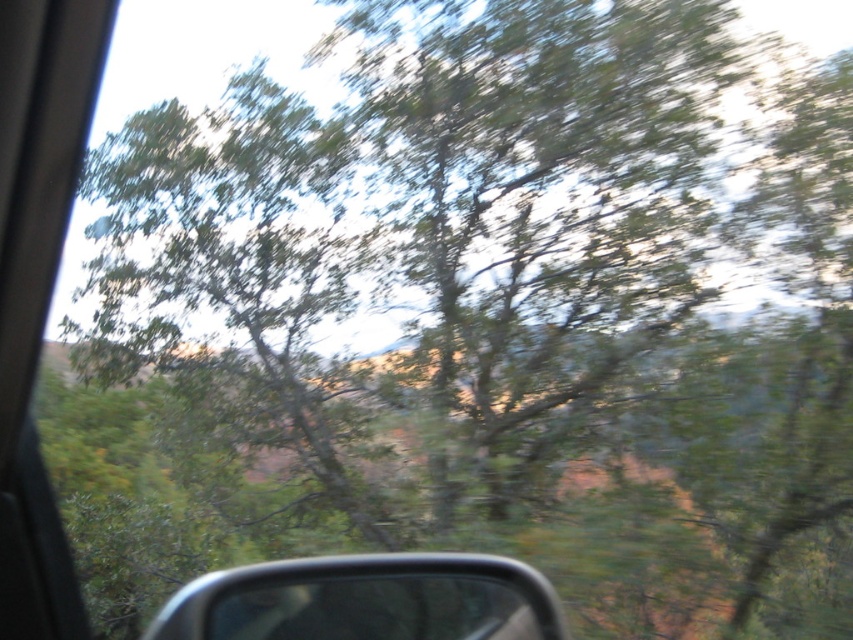
You are a passenger in a moving car and notice a point at coordinates (230, 273). What object is located at that point?

The point at coordinates (230, 273) has a green leafy tree at center located there.

Consider the image. You are a passenger in a car and you see two points outside the window, one at point coordinates point (x=158, y=340) and the other at point coordinates point (x=370, y=568). Which point is closer to you?

Point (x=158, y=340) is further to the viewer than point (x=370, y=568), so the point closer to you is point (x=370, y=568).

You are a passenger in a car and notice the green leafy tree at center and the metallic gray side mirror at lower center. Which object is closer to you?

The metallic gray side mirror at lower center is closer to you because it is behind the green leafy tree at center, meaning the tree is further away.